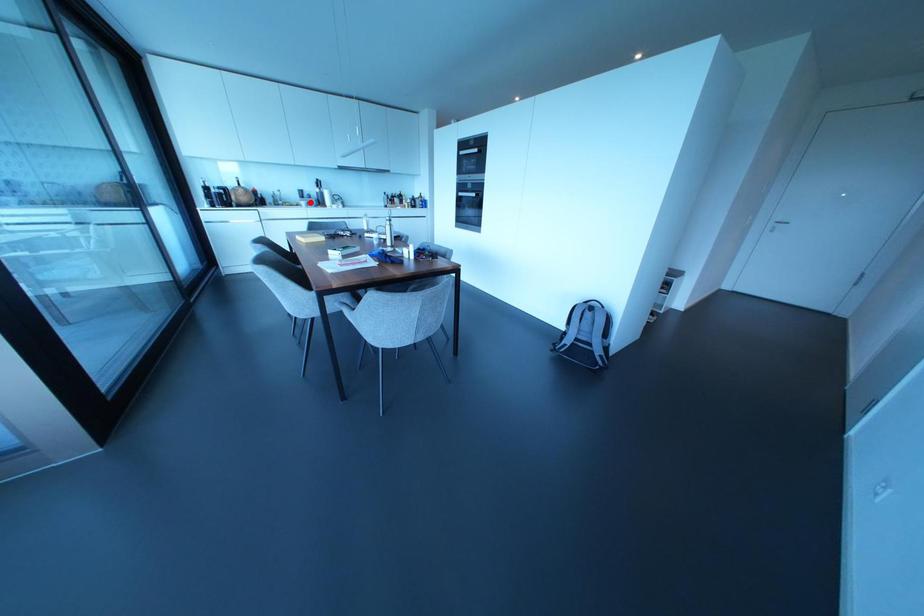
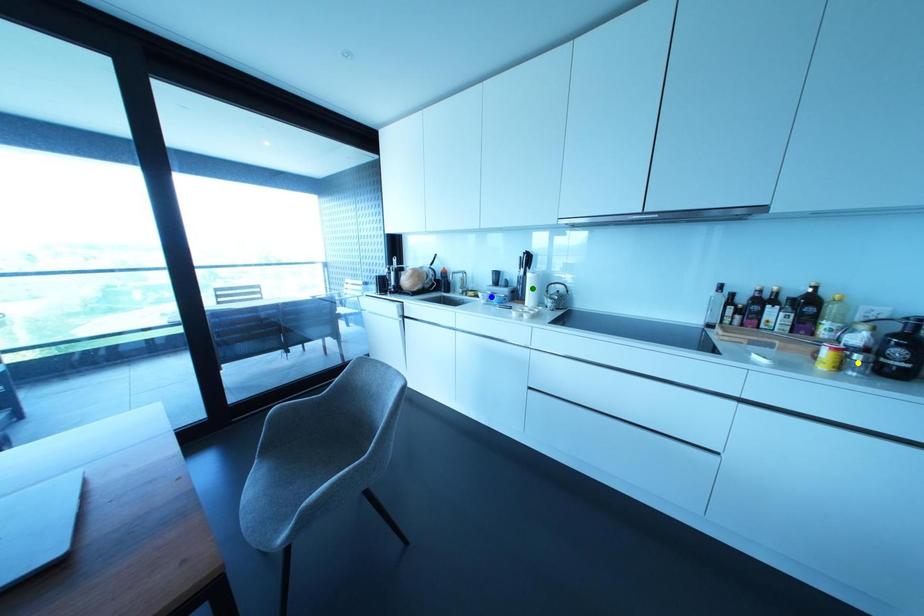
Question: I am providing you with two images of the same scene from different viewpoints. A red point is marked on the first image. You are given multiple points on the second image. Which spot in image 2 lines up with the point in image 1?

Choices:
 (A) yellow point
 (B) green point
 (C) blue point

Answer: (C)